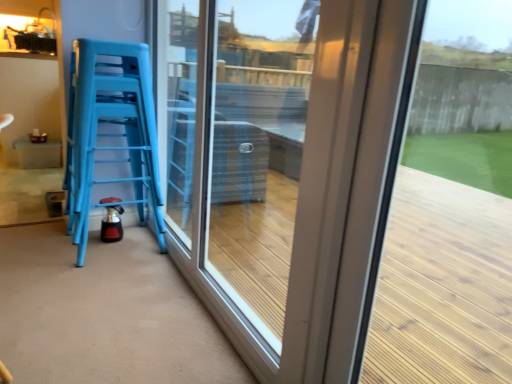
Question: Looking at their shapes, would you say blue plastic stools at left is wider or thinner than transparent glass door at center?

Choices:
 (A) wide
 (B) thin

Answer: (A)

Question: From their relative heights in the image, would you say blue plastic stools at left is taller or shorter than transparent glass door at center?

Choices:
 (A) tall
 (B) short

Answer: (B)

Question: Is blue plastic stools at left bigger or smaller than transparent glass door at center?

Choices:
 (A) big
 (B) small

Answer: (B)

Question: Looking at their shapes, would you say transparent glass door at center is wider or thinner than blue plastic stools at left?

Choices:
 (A) wide
 (B) thin

Answer: (B)

Question: Would you say transparent glass door at center is to the left or to the right of blue plastic stools at left in the picture?

Choices:
 (A) right
 (B) left

Answer: (A)

Question: Do you think transparent glass door at center is within blue plastic stools at left, or outside of it?

Choices:
 (A) outside
 (B) inside

Answer: (A)

Question: Is point (318, 74) closer or farther from the camera than point (101, 67)?

Choices:
 (A) closer
 (B) farther

Answer: (A)